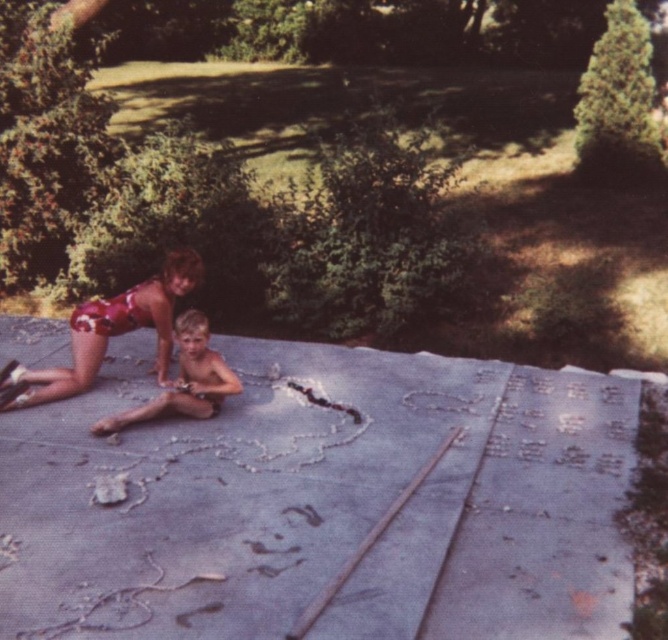
Question: Does shiny metallic bikini top at lower left have a greater width compared to smooth skin child at center?

Choices:
 (A) no
 (B) yes

Answer: (B)

Question: Among these points, which one is nearest to the camera?

Choices:
 (A) pyautogui.click(x=226, y=380)
 (B) pyautogui.click(x=146, y=323)

Answer: (A)

Question: From the image, what is the correct spatial relationship of shiny metallic bikini top at lower left in relation to smooth skin child at center?

Choices:
 (A) left
 (B) right

Answer: (A)

Question: Which point is closer to the camera?

Choices:
 (A) (39, 385)
 (B) (188, 314)

Answer: (B)

Question: Is shiny metallic bikini top at lower left above smooth skin child at center?

Choices:
 (A) yes
 (B) no

Answer: (A)